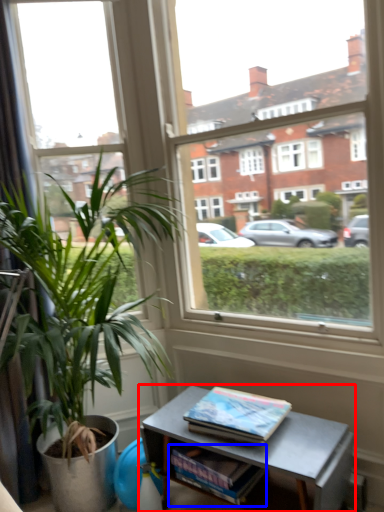
Question: Which object is closer to the camera taking this photo, table (highlighted by a red box) or magazine (highlighted by a blue box)?

Choices:
 (A) table
 (B) magazine

Answer: (A)